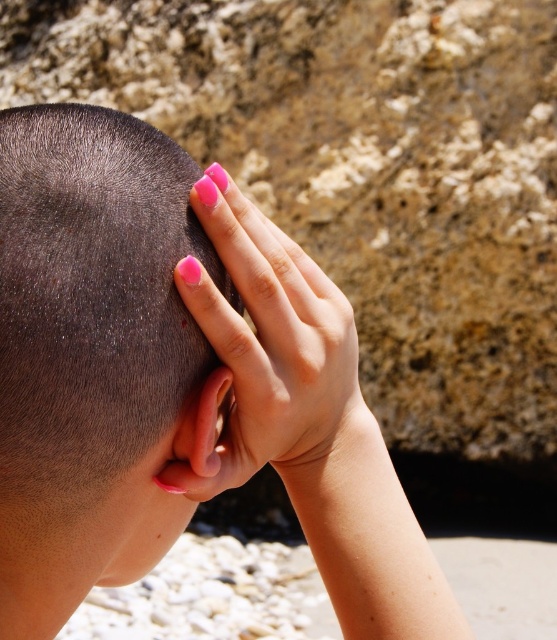
Question: Which point appears closest to the camera in this image?

Choices:
 (A) (251, 292)
 (B) (170, 532)

Answer: (A)

Question: Which of the following is the farthest from the observer?

Choices:
 (A) matte black hair at center
 (B) pink polished nails at upper center

Answer: (B)

Question: Where is matte black hair at center located in relation to pink polished nails at upper center in the image?

Choices:
 (A) left
 (B) right

Answer: (A)

Question: Is matte black hair at center to the left of pink polished nails at upper center from the viewer's perspective?

Choices:
 (A) no
 (B) yes

Answer: (B)

Question: Does matte black hair at center come in front of pink polished nails at upper center?

Choices:
 (A) no
 (B) yes

Answer: (B)

Question: Which object is farther from the camera taking this photo?

Choices:
 (A) matte black hair at center
 (B) pink polished nails at upper center

Answer: (B)